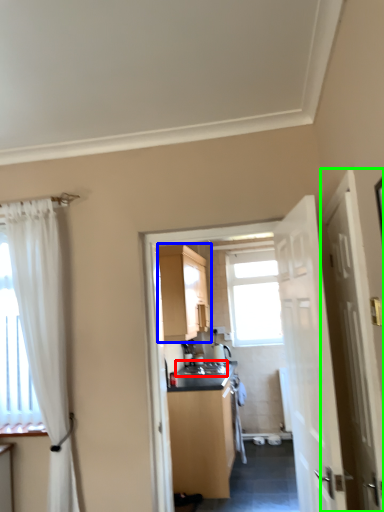
Question: Which object is the farthest from sink (highlighted by a red box)? Choose among these: cabinetry (highlighted by a blue box) or door (highlighted by a green box).

Choices:
 (A) cabinetry
 (B) door

Answer: (B)